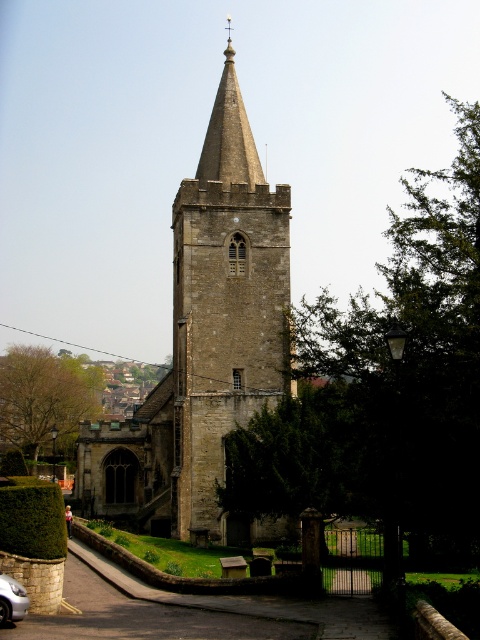
Question: Is green leafy tree at left bigger than smooth stone spire at center?

Choices:
 (A) no
 (B) yes

Answer: (A)

Question: Which point is closer to the camera?

Choices:
 (A) (218, 156)
 (B) (430, 253)
 (C) (16, 616)

Answer: (C)

Question: Which point is closer to the camera?

Choices:
 (A) (216, 515)
 (B) (255, 163)
 (C) (439, 468)

Answer: (C)

Question: Among these points, which one is farthest from the camera?

Choices:
 (A) (177, 196)
 (B) (471, 138)
 (C) (4, 624)

Answer: (A)

Question: From the image, what is the correct spatial relationship of green leafy tree at left in relation to silver metallic car at lower left?

Choices:
 (A) right
 (B) left

Answer: (B)

Question: In this image, where is stone church steeple at center located relative to green leafy tree at left?

Choices:
 (A) above
 (B) below

Answer: (A)